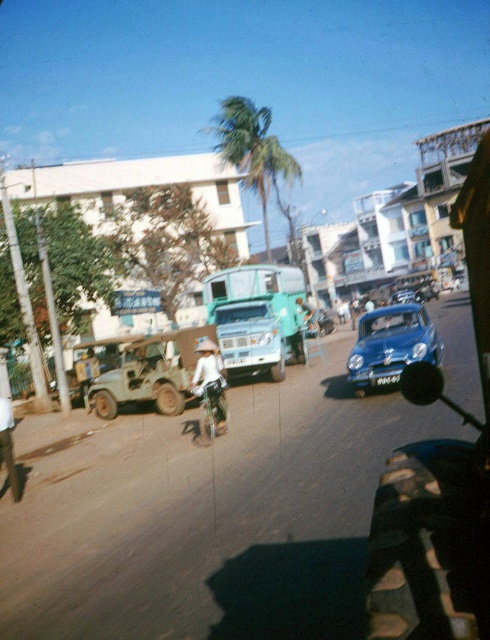
You are a delivery person who needs to park your vehicle in a narrow alley. The alley can only accommodate vehicles that are narrower than the light green matte jeep at left. Do you think your shiny blue car at center will fit in the alley?

The light green matte jeep at left is thinner than the shiny blue car at center. Since the alley can only accommodate vehicles narrower than the light green matte jeep at left, the shiny blue car at center is wider and therefore will not fit in the alley.

In the scene shown: You are a delivery person who needs to pass through the narrow alley between the teal matte truck at center and the white fabric hat at center. The alley is only 1.2 meters wide. Can your 1.0 meter wide delivery cart fit through?

The teal matte truck at center might be wider than white fabric hat at center. However, since the alley is 1.2 meters wide and the delivery cart is 1.0 meters wide, there is a possibility it could fit if the combined width of the truck and hat does not exceed 1.2 meters. But without exact measurements, it is uncertain.